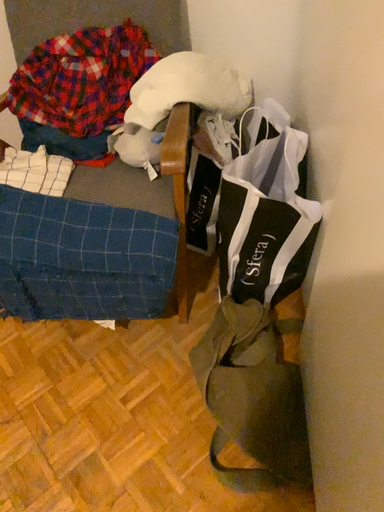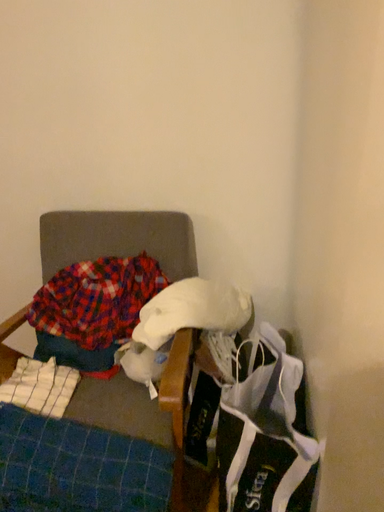
Question: How did the camera likely rotate when shooting the video?

Choices:
 (A) rotated downward
 (B) rotated upward

Answer: (B)